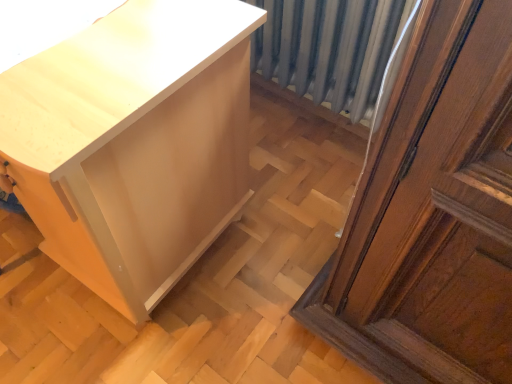
Question: Is white glossy cabinet at lower left taller or shorter than metallic gray radiator at center?

Choices:
 (A) short
 (B) tall

Answer: (B)

Question: Looking at their shapes, would you say white glossy cabinet at lower left is wider or thinner than metallic gray radiator at center?

Choices:
 (A) wide
 (B) thin

Answer: (A)

Question: Would you say white glossy cabinet at lower left is to the left or to the right of metallic gray radiator at center in the picture?

Choices:
 (A) left
 (B) right

Answer: (A)

Question: Is metallic gray radiator at center in front of or behind white glossy cabinet at lower left in the image?

Choices:
 (A) front
 (B) behind

Answer: (B)

Question: Based on their sizes in the image, would you say metallic gray radiator at center is bigger or smaller than white glossy cabinet at lower left?

Choices:
 (A) big
 (B) small

Answer: (B)

Question: From the image's perspective, is metallic gray radiator at center positioned above or below white glossy cabinet at lower left?

Choices:
 (A) below
 (B) above

Answer: (B)

Question: In terms of height, does metallic gray radiator at center look taller or shorter compared to white glossy cabinet at lower left?

Choices:
 (A) short
 (B) tall

Answer: (A)